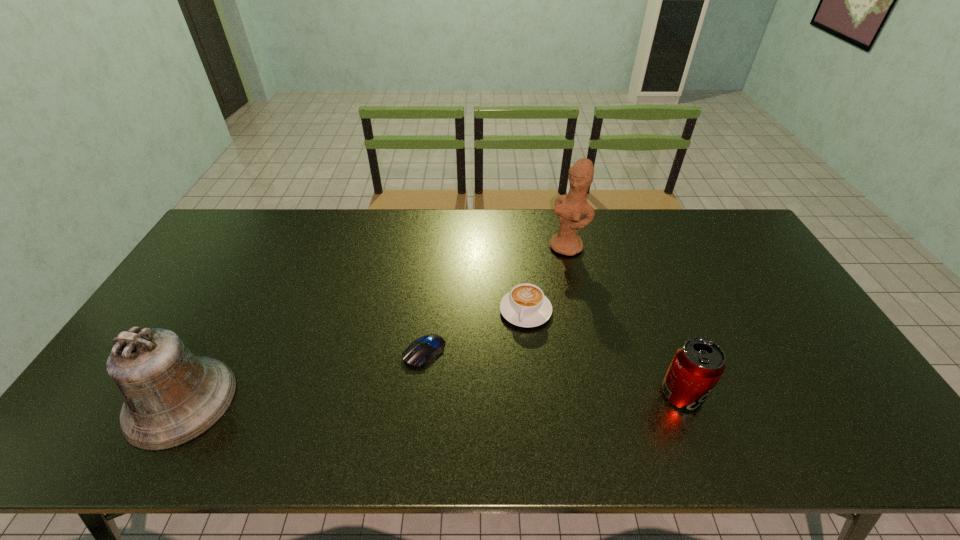
You are a GUI agent. You are given a task and a screenshot of the screen. Output one action in this format:
    pyautogui.click(x=<x>, y=<y>)
    Task: Click on the vacant space on the desktop that is between the bell and the soda can and is positioned on the side of the second farthest object with the handle
    The width and height of the screenshot is (960, 540).
    Given the screenshot: What is the action you would take?
    pyautogui.click(x=498, y=396)

At what (x,y) coordinates should I click in order to perform the action: click on vacant spot on the desktop that is between the leftmost object and the soda can and is positioned on the button side of the shortest object. Please return your answer as a coordinate pair (x, y). This screenshot has width=960, height=540. Looking at the image, I should click on (358, 399).

Locate an element on the screen. The height and width of the screenshot is (540, 960). free space on the desktop that is between the bell and the rightmost object and is positioned on the front-facing side of the tallest object is located at coordinates (413, 397).